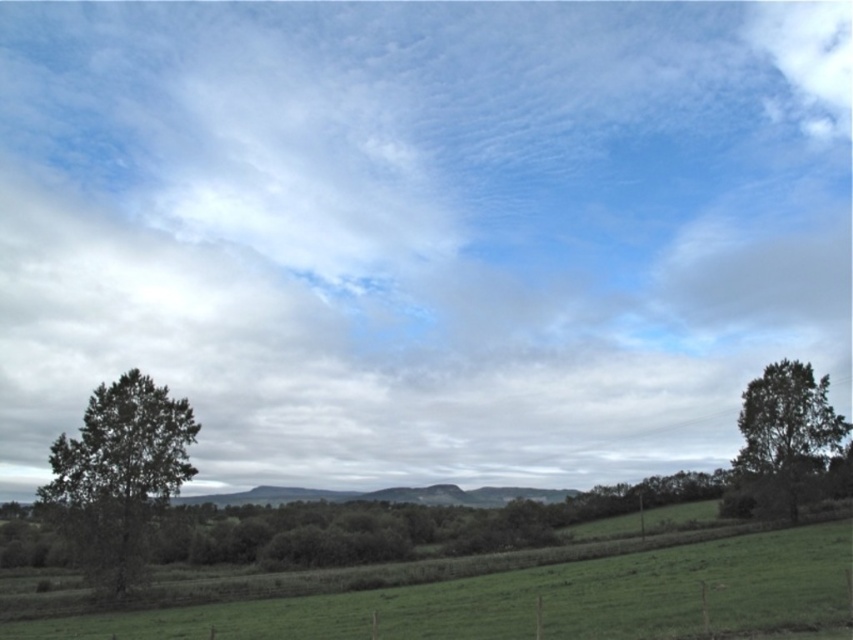
Which is more to the right, green grassy field at lower center or green leafy tree at right?

From the viewer's perspective, green leafy tree at right appears more on the right side.

Who is lower down, green grassy field at lower center or green leafy tree at right?

green leafy tree at right is below.

Is point (712, 541) in front of point (828, 424)?

That is True.

In order to click on green grassy field at lower center in this screenshot , I will do `click(526, 596)`.

Can you confirm if green grassy field at lower center is bigger than green matte tree at lower left?

Yes.

Does point (811, 579) come behind point (119, 531)?

No, (811, 579) is closer to viewer.

At what (x,y) coordinates should I click in order to perform the action: click on green grassy field at lower center. Please return your answer as a coordinate pair (x, y). The width and height of the screenshot is (853, 640). Looking at the image, I should click on (526, 596).

From the picture: Does green matte tree at lower left come in front of green leafy tree at right?

Yes.

Between green matte tree at lower left and green leafy tree at right, which one is positioned higher?

green matte tree at lower left

Does point (122, 424) lie in front of point (817, 472)?

Yes, it is.

Locate an element on the screen. green matte tree at lower left is located at coordinates (119, 476).